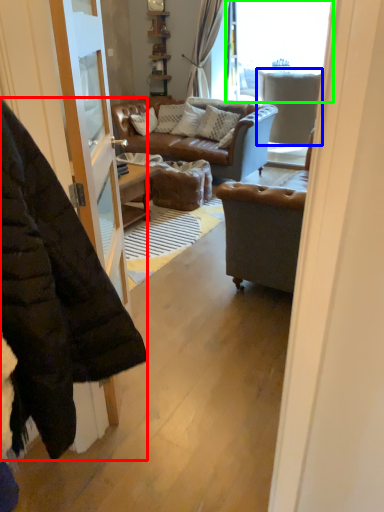
Question: Considering the real-world distances, which object is closest to jacket (highlighted by a red box)? armchair (highlighted by a blue box) or window (highlighted by a green box).

Choices:
 (A) armchair
 (B) window

Answer: (A)